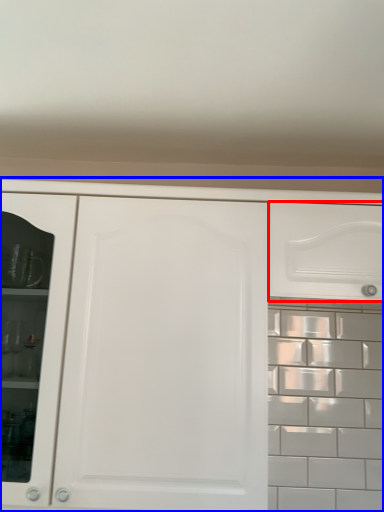
Question: Which of the following is the farthest to the observer, drawer (highlighted by a red box) or cabinetry (highlighted by a blue box)?

Choices:
 (A) drawer
 (B) cabinetry

Answer: (A)